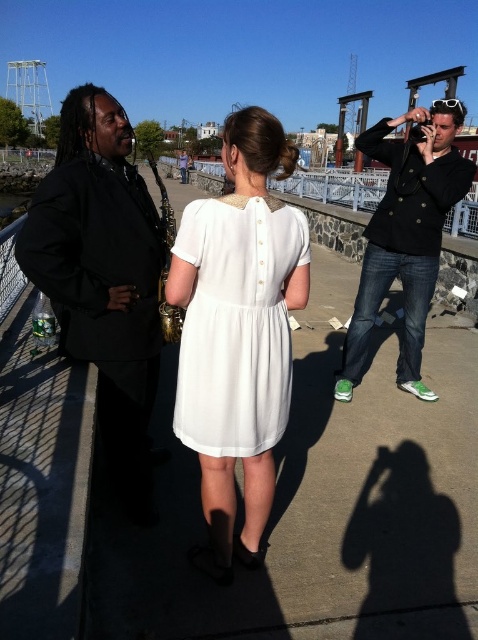
Question: Is black matte suit at left to the right of white satin dress at center from the viewer's perspective?

Choices:
 (A) yes
 (B) no

Answer: (B)

Question: Which of the following is the closest to the observer?

Choices:
 (A) white satin dress at center
 (B) black leather jacket at right
 (C) black matte suit at left

Answer: (A)

Question: Is black matte suit at left closer to camera compared to white satin dress at center?

Choices:
 (A) no
 (B) yes

Answer: (A)

Question: Can you confirm if black matte suit at left is positioned to the right of white satin dress at center?

Choices:
 (A) yes
 (B) no

Answer: (B)

Question: Among these objects, which one is farthest from the camera?

Choices:
 (A) white satin dress at center
 (B) black leather jacket at right

Answer: (B)

Question: Among these objects, which one is nearest to the camera?

Choices:
 (A) black leather jacket at right
 (B) white satin dress at center
 (C) black matte suit at left

Answer: (B)